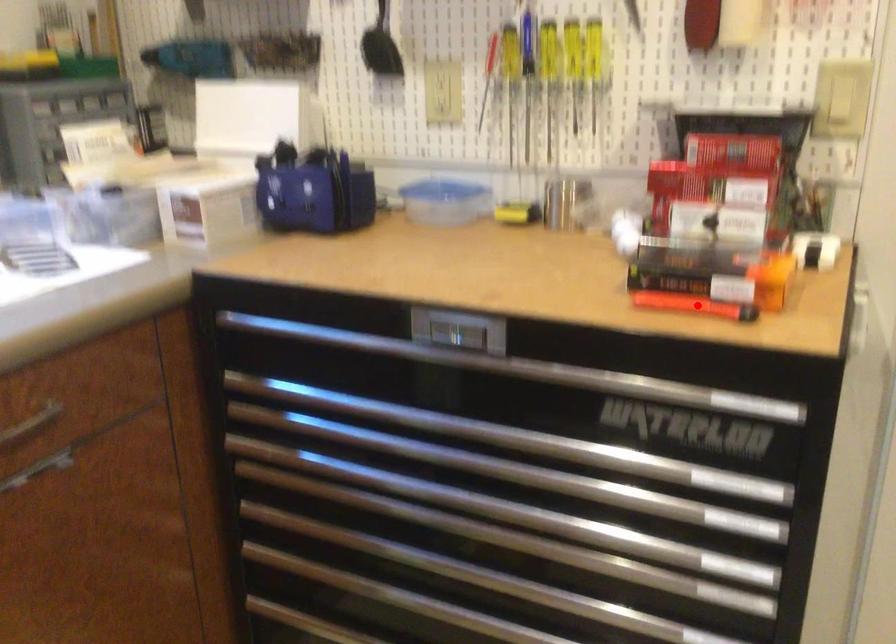
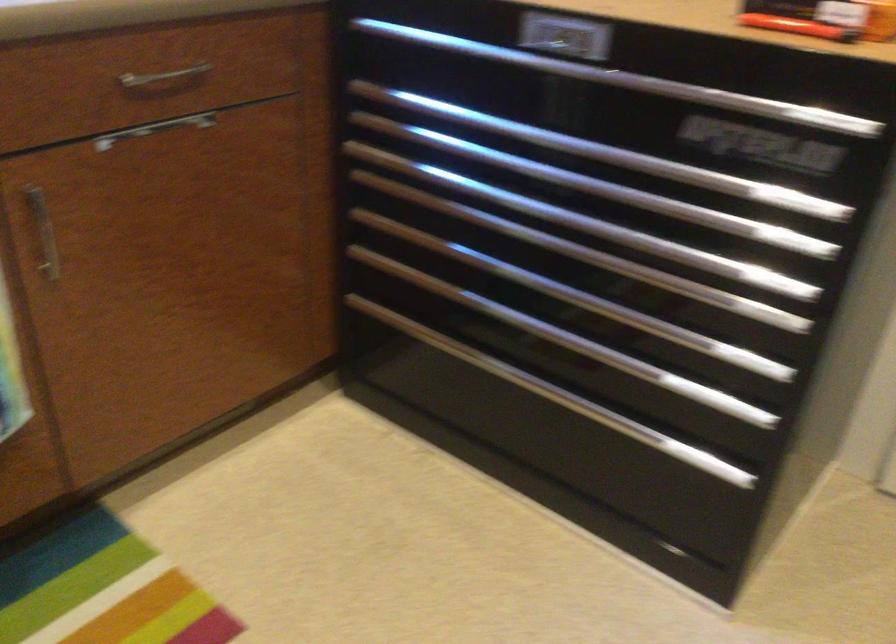
Locate, in the second image, the point that corresponds to the highlighted location in the first image.

(797, 26)